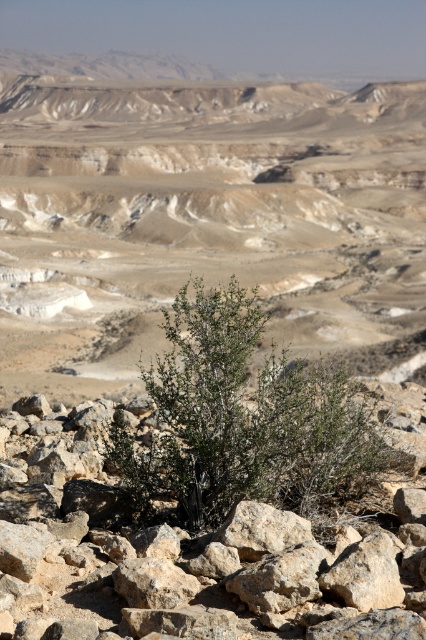
Question: Is rough textured rock at center smaller than green leafy shrub at center?

Choices:
 (A) no
 (B) yes

Answer: (B)

Question: Which point is farther to the camera?

Choices:
 (A) (160, 396)
 (B) (244, 525)

Answer: (A)

Question: Is rough textured rock at center further to the viewer compared to green leafy shrub at center?

Choices:
 (A) no
 (B) yes

Answer: (A)

Question: Among these objects, which one is nearest to the camera?

Choices:
 (A) rough textured rock at center
 (B) green leafy shrub at center

Answer: (A)

Question: Is rough textured rock at center bigger than green leafy shrub at center?

Choices:
 (A) yes
 (B) no

Answer: (B)